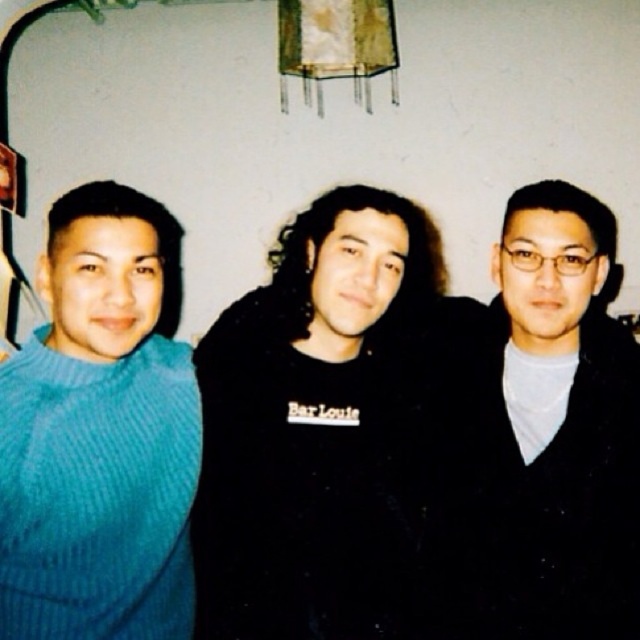
Question: In this image, where is black matte shirt at center located relative to black matte sweater at center?

Choices:
 (A) left
 (B) right

Answer: (A)

Question: Among these points, which one is nearest to the camera?

Choices:
 (A) (136, 456)
 (B) (576, 195)

Answer: (A)

Question: Which of the following is the closest to the observer?

Choices:
 (A) black matte sweater at center
 (B) black matte shirt at center

Answer: (B)

Question: Is black matte sweater at center wider than corduroy blue sweater at left?

Choices:
 (A) no
 (B) yes

Answer: (B)

Question: Does black matte shirt at center appear over black matte sweater at center?

Choices:
 (A) yes
 (B) no

Answer: (B)

Question: Which object is positioned farthest from the black matte sweater at center?

Choices:
 (A) corduroy blue sweater at left
 (B) black matte shirt at center

Answer: (A)